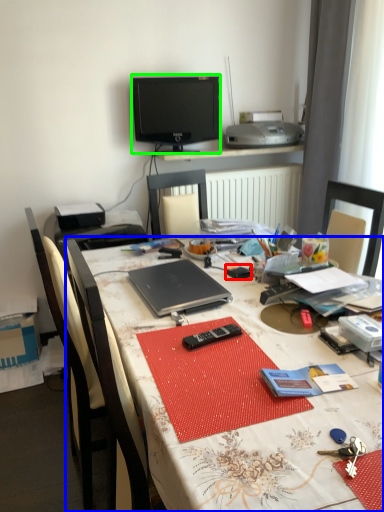
Question: Which object is positioned farthest from stationery (highlighted by a red box)? Select from desk (highlighted by a blue box) and television (highlighted by a green box).

Choices:
 (A) desk
 (B) television

Answer: (B)